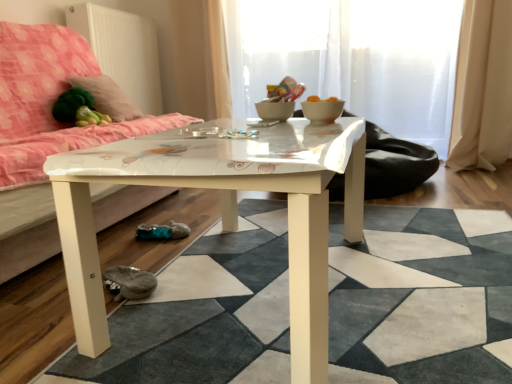
Locate an element on the screen. This screenshot has width=512, height=384. free space in front of gray suede shoe at lower left is located at coordinates (120, 321).